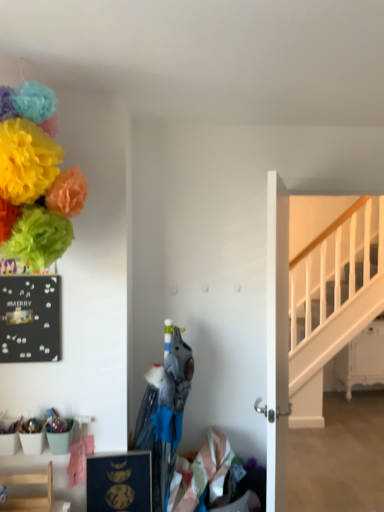
Question: Does point (48, 494) appear closer or farther from the camera than point (266, 278)?

Choices:
 (A) closer
 (B) farther

Answer: (A)

Question: Would you say light wood chair at lower left is inside or outside white glossy door at center?

Choices:
 (A) outside
 (B) inside

Answer: (A)

Question: Which of these objects is positioned farthest from the white glossy door at center?

Choices:
 (A) white wooden stairs at right
 (B) black matte bulletin board at left
 (C) matte paper flowers at upper left
 (D) blue matte picture frame at lower center
 (E) light wood chair at lower left

Answer: (A)

Question: Estimate the real-world distances between objects in this image. Which object is farther from the light wood chair at lower left?

Choices:
 (A) white glossy door at center
 (B) black matte bulletin board at left
 (C) blue matte picture frame at lower center
 (D) matte paper flowers at upper left
 (E) white wooden stairs at right

Answer: (E)